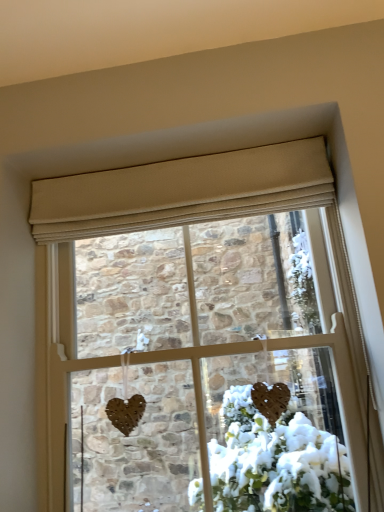
Question: Is matte brown heart at center in front of or behind beige fabric curtain at upper center in the image?

Choices:
 (A) behind
 (B) front

Answer: (B)

Question: Looking at the image, does matte brown heart at center seem bigger or smaller compared to beige fabric curtain at upper center?

Choices:
 (A) small
 (B) big

Answer: (B)

Question: From a real-world perspective, is matte brown heart at center physically located above or below beige fabric curtain at upper center?

Choices:
 (A) above
 (B) below

Answer: (B)

Question: Which is correct: beige fabric curtain at upper center is inside matte brown heart at center, or outside of it?

Choices:
 (A) inside
 (B) outside

Answer: (B)

Question: Considering the positions of beige fabric curtain at upper center and matte brown heart at center in the image, is beige fabric curtain at upper center wider or thinner than matte brown heart at center?

Choices:
 (A) wide
 (B) thin

Answer: (B)

Question: Is beige fabric curtain at upper center in front of or behind matte brown heart at center in the image?

Choices:
 (A) behind
 (B) front

Answer: (A)

Question: From the image's perspective, is beige fabric curtain at upper center above or below matte brown heart at center?

Choices:
 (A) above
 (B) below

Answer: (A)